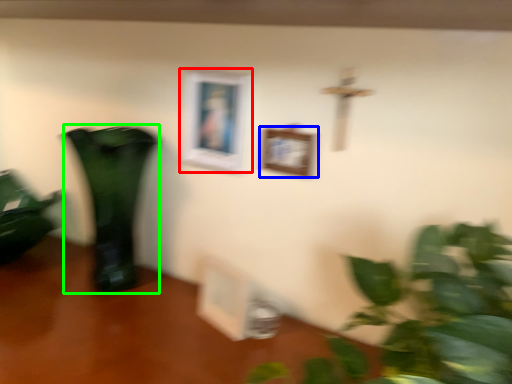
Question: Which object is the closest to the picture frame (highlighted by a red box)? Choose among these: picture frame (highlighted by a blue box) or vase (highlighted by a green box).

Choices:
 (A) picture frame
 (B) vase

Answer: (A)